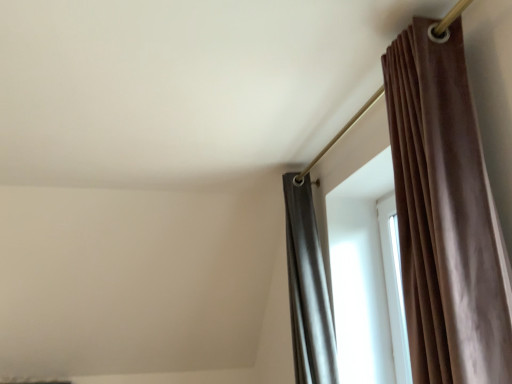
In order to face silky brown curtain at upper right, should I rotate leftwards or rightwards?

To face it directly, rotate right by 13.991 degrees.

What do you see at coordinates (368, 276) in the screenshot? I see `silky brown curtain at upper right` at bounding box center [368, 276].

The width and height of the screenshot is (512, 384). Find the location of `silky brown curtain at upper right`. silky brown curtain at upper right is located at coordinates (368, 276).

The image size is (512, 384). I want to click on silky brown curtain at upper right, so click(368, 276).